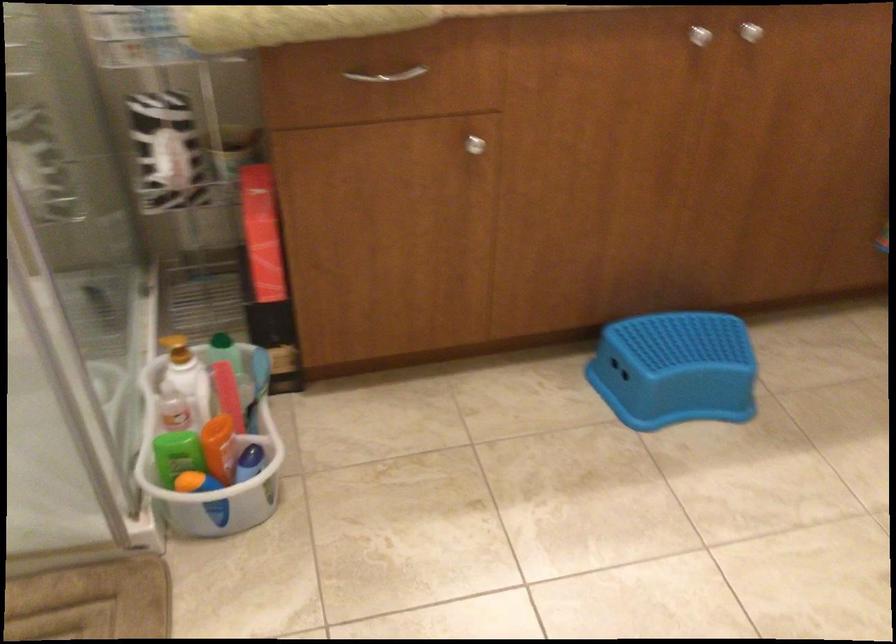
Locate an element on the screen. silver drawer handle is located at coordinates (386, 75).